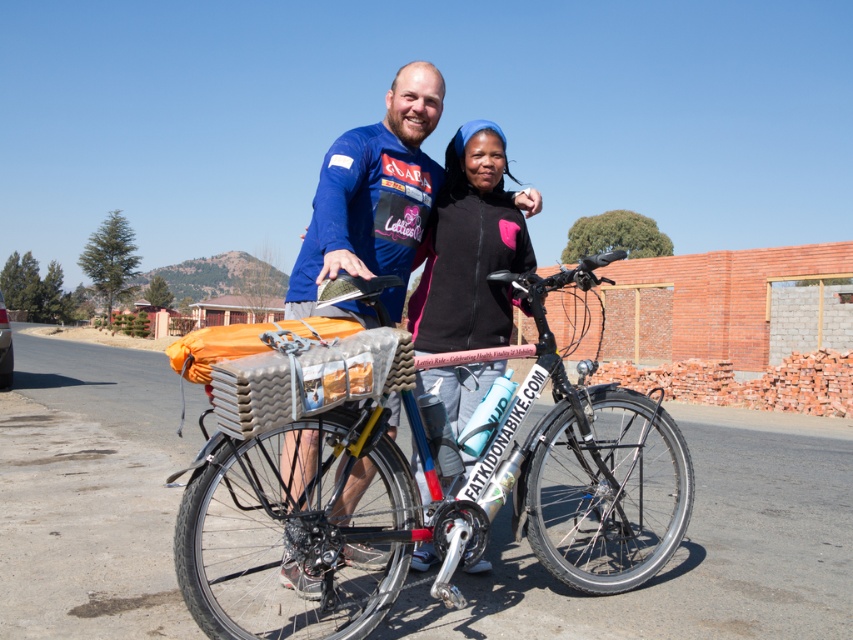
From the picture: Can you confirm if silver metallic bicycle at center is positioned below blue fabric shirt at center?

Yes, silver metallic bicycle at center is below blue fabric shirt at center.

Find the location of a particular element. The height and width of the screenshot is (640, 853). silver metallic bicycle at center is located at coordinates (302, 531).

Is blue fabric shirt at center above black fleece jacket at center?

Incorrect, blue fabric shirt at center is not positioned above black fleece jacket at center.

Describe the element at coordinates (370, 196) in the screenshot. Image resolution: width=853 pixels, height=640 pixels. I see `blue fabric shirt at center` at that location.

Is point (410, 74) positioned before point (466, 396)?

Yes, it is.

Image resolution: width=853 pixels, height=640 pixels. I want to click on blue fabric shirt at center, so click(370, 196).

From the picture: Can you confirm if silver metallic bicycle at center is thinner than black fleece jacket at center?

No, silver metallic bicycle at center is not thinner than black fleece jacket at center.

This screenshot has height=640, width=853. In order to click on silver metallic bicycle at center in this screenshot , I will do `click(302, 531)`.

The width and height of the screenshot is (853, 640). In order to click on silver metallic bicycle at center in this screenshot , I will do `click(302, 531)`.